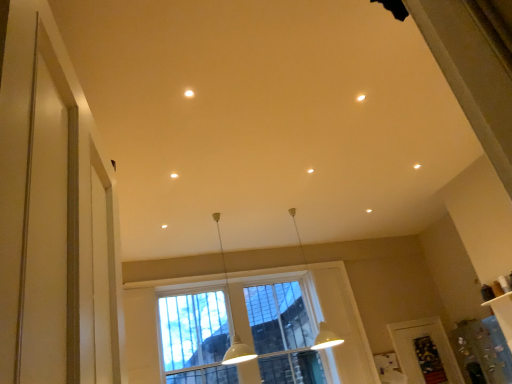
Question: Should I look upward or downward to see clear plastic screen door at lower right?

Choices:
 (A) up
 (B) down

Answer: (B)

Question: Does clear glass window at center lie in front of clear plastic screen door at lower right?

Choices:
 (A) no
 (B) yes

Answer: (B)

Question: Is clear glass window at center touching clear plastic screen door at lower right?

Choices:
 (A) no
 (B) yes

Answer: (A)

Question: Is clear glass window at center wider than clear plastic screen door at lower right?

Choices:
 (A) yes
 (B) no

Answer: (A)

Question: Is clear glass window at center facing towards clear plastic screen door at lower right?

Choices:
 (A) no
 (B) yes

Answer: (A)

Question: Is clear glass window at center thinner than clear plastic screen door at lower right?

Choices:
 (A) yes
 (B) no

Answer: (B)

Question: Is clear glass window at center not close to clear plastic screen door at lower right?

Choices:
 (A) yes
 (B) no

Answer: (A)

Question: Considering the relative sizes of matte white light fixture at upper center and white matte pendant light at center, marked as the first lamp in a right-to-left arrangement, in the image provided, is matte white light fixture at upper center wider than white matte pendant light at center, marked as the first lamp in a right-to-left arrangement,?

Choices:
 (A) yes
 (B) no

Answer: (B)

Question: Is matte white light fixture at upper center at the right side of white matte pendant light at center, which is the second lamp in left-to-right order?

Choices:
 (A) no
 (B) yes

Answer: (A)

Question: From a real-world perspective, is matte white light fixture at upper center under white matte pendant light at center, which is the second lamp in left-to-right order?

Choices:
 (A) no
 (B) yes

Answer: (A)

Question: Would you say matte white light fixture at upper center contains white matte pendant light at center, marked as the first lamp in a right-to-left arrangement?

Choices:
 (A) no
 (B) yes

Answer: (A)

Question: Does matte white light fixture at upper center have a lesser width compared to white matte pendant light at center, which is the second lamp in left-to-right order?

Choices:
 (A) no
 (B) yes

Answer: (B)

Question: Is matte white light fixture at upper center positioned behind white matte pendant light at center, marked as the first lamp in a right-to-left arrangement?

Choices:
 (A) yes
 (B) no

Answer: (B)

Question: Is matte white light fixture at upper center turned away from clear glass window at center?

Choices:
 (A) no
 (B) yes

Answer: (A)